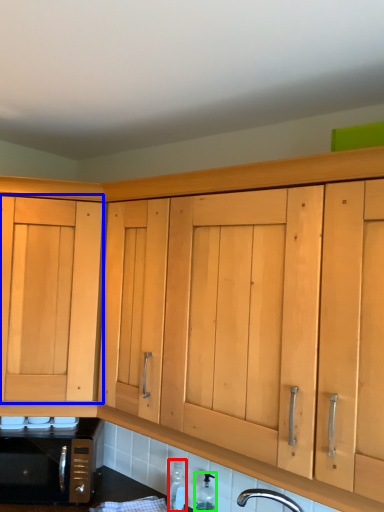
Question: Estimate the real-world distances between objects in this image. Which object is closer to bottle (highlighted by a red box), cabinetry (highlighted by a blue box) or bottle (highlighted by a green box)?

Choices:
 (A) cabinetry
 (B) bottle

Answer: (B)